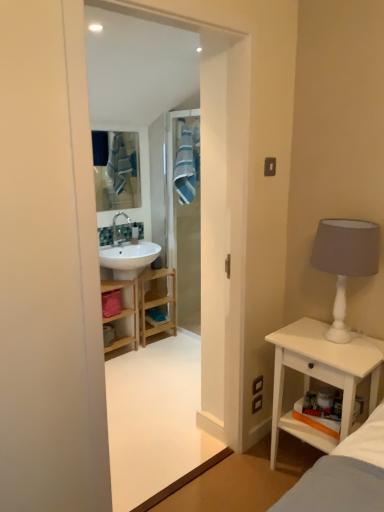
Question: Is the position of blue fabric mirror at upper center more distant than that of white glossy sink at upper left?

Choices:
 (A) no
 (B) yes

Answer: (A)

Question: Does blue fabric mirror at upper center have a smaller size compared to white glossy sink at upper left?

Choices:
 (A) yes
 (B) no

Answer: (B)

Question: Does blue fabric mirror at upper center have a lesser height compared to white glossy sink at upper left?

Choices:
 (A) no
 (B) yes

Answer: (A)

Question: From a real-world perspective, is blue fabric mirror at upper center physically below white glossy sink at upper left?

Choices:
 (A) no
 (B) yes

Answer: (A)

Question: From a real-world perspective, is blue fabric mirror at upper center over white glossy sink at upper left?

Choices:
 (A) no
 (B) yes

Answer: (B)

Question: From their relative heights in the image, would you say white glossy sink at upper left is taller or shorter than blue fabric mirror at upper center?

Choices:
 (A) short
 (B) tall

Answer: (A)

Question: From a real-world perspective, is white glossy sink at upper left above or below blue fabric mirror at upper center?

Choices:
 (A) above
 (B) below

Answer: (B)

Question: Considering their positions, is white glossy sink at upper left located in front of or behind blue fabric mirror at upper center?

Choices:
 (A) front
 (B) behind

Answer: (B)

Question: Considering the positions of white glossy sink at upper left and blue fabric mirror at upper center in the image, is white glossy sink at upper left bigger or smaller than blue fabric mirror at upper center?

Choices:
 (A) small
 (B) big

Answer: (A)

Question: In terms of width, does white matte table lamp at right look wider or thinner when compared to white glossy sink at upper left?

Choices:
 (A) thin
 (B) wide

Answer: (B)

Question: From the image's perspective, is white matte table lamp at right located above or below white glossy sink at upper left?

Choices:
 (A) above
 (B) below

Answer: (B)

Question: Is point (360, 253) closer or farther from the camera than point (130, 230)?

Choices:
 (A) closer
 (B) farther

Answer: (A)

Question: From a real-world perspective, relative to white glossy sink at upper left, is white matte table lamp at right vertically above or below?

Choices:
 (A) below
 (B) above

Answer: (B)

Question: Is point coord(135,228) positioned closer to the camera than point coord(135,300)?

Choices:
 (A) closer
 (B) farther

Answer: (B)

Question: Do you think white glossy sink at upper left is within wooden cabinet at center, or outside of it?

Choices:
 (A) inside
 (B) outside

Answer: (B)